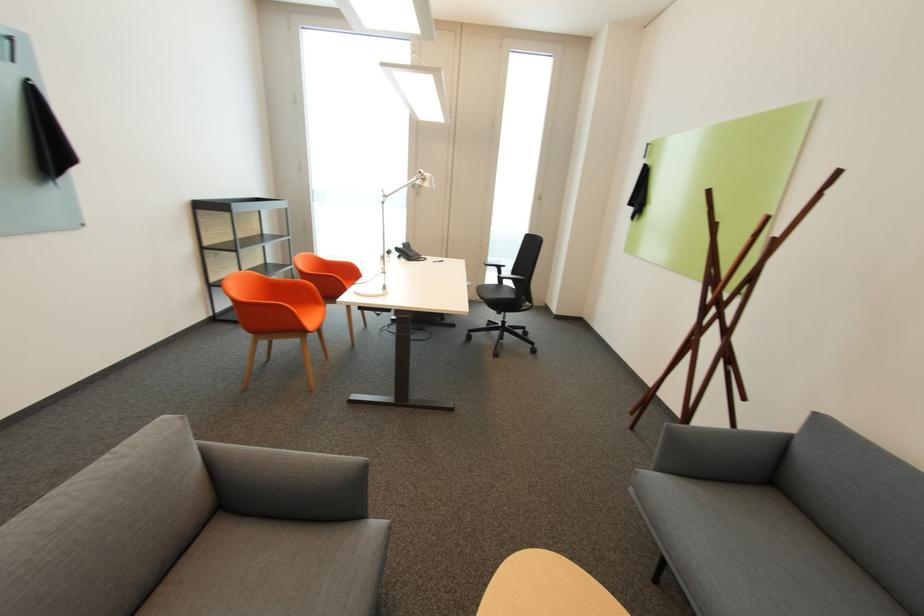
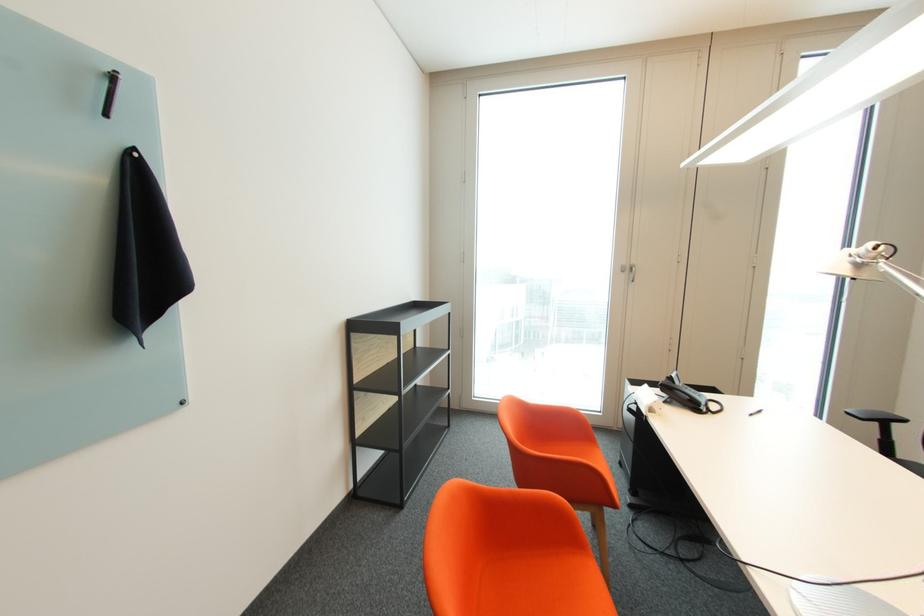
What movement of the cameraman would produce the second image?

The cameraman moved toward left, forward.